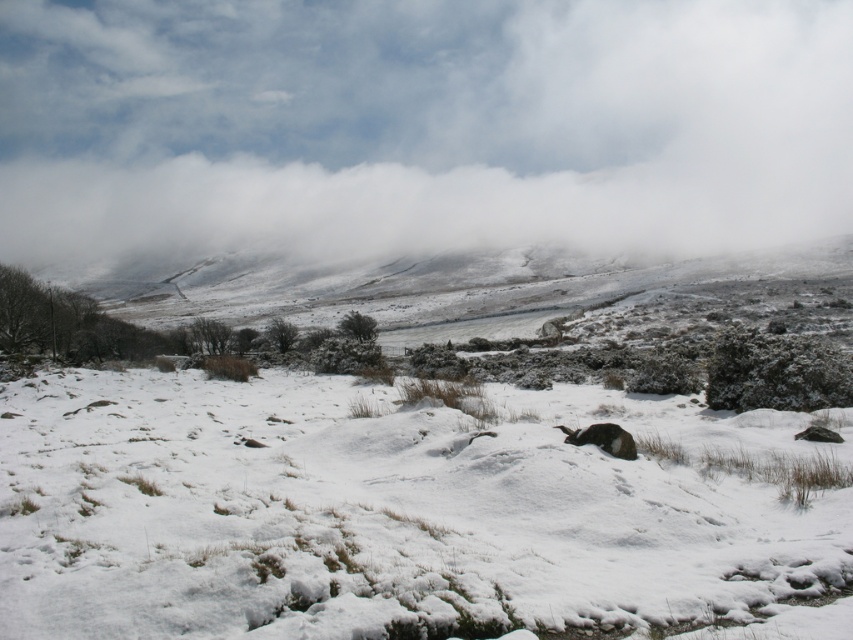
Question: Can you confirm if white fluffy cloud at upper center is positioned to the right of furry black animal at center?

Choices:
 (A) no
 (B) yes

Answer: (A)

Question: Which object is the closest to the furry black animal at center?

Choices:
 (A) white fluffy cloud at upper center
 (B) snowy grass at center

Answer: (B)

Question: Can you confirm if white fluffy cloud at upper center is positioned to the right of furry black animal at center?

Choices:
 (A) no
 (B) yes

Answer: (A)

Question: Which point is farther to the camera?

Choices:
 (A) white fluffy cloud at upper center
 (B) snowy grass at center
 (C) furry black animal at center

Answer: (A)

Question: Which of these objects is positioned closest to the snowy grass at center?

Choices:
 (A) white fluffy cloud at upper center
 (B) furry black animal at center

Answer: (B)

Question: Does snowy grass at center appear on the left side of furry black animal at center?

Choices:
 (A) yes
 (B) no

Answer: (B)